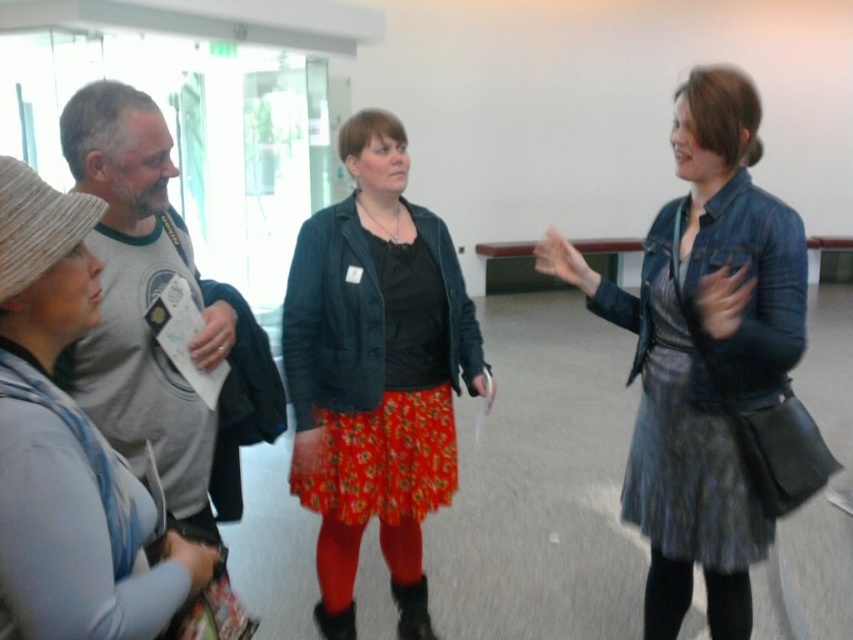
You are a delivery person who needs to place a small package between the denim jacket at center and the black tights at lower right. Can you fit it there if the package is 7 inches long?

The denim jacket at center is 8.10 inches away from the black tights at lower right. Since the package is 7 inches long, it can fit between them as the distance is sufficient.

Looking at this image, you are standing at the point labeled as point (665, 588). Looking towards the entrance of the room, which direction is the other point, point (345, 513), located relative to you?

The point (345, 513) is behind point (665, 588), so if you are standing at point (665, 588) facing the entrance, the other point would be behind you.